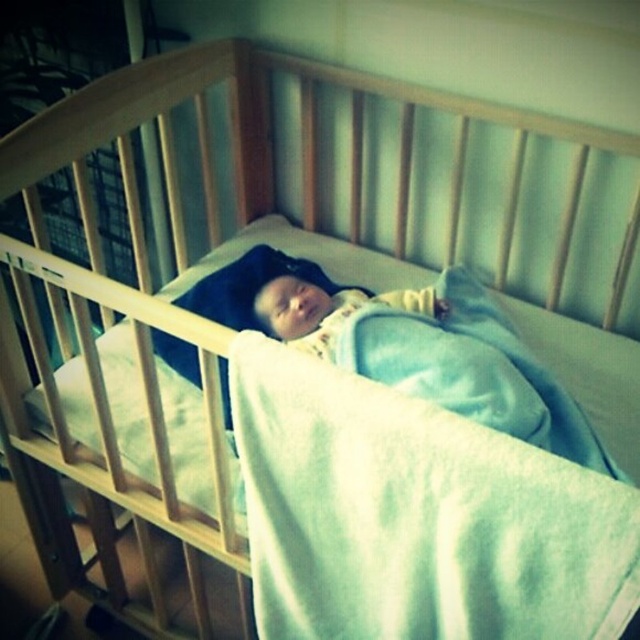
Question: Among these objects, which one is nearest to the camera?

Choices:
 (A) soft yellow fabric at center
 (B) light blue soft blanket at center

Answer: (B)

Question: Considering the relative positions of light blue soft blanket at center and soft yellow fabric at center in the image provided, where is light blue soft blanket at center located with respect to soft yellow fabric at center?

Choices:
 (A) right
 (B) left

Answer: (A)

Question: Which point is farther to the camera?

Choices:
 (A) light blue soft blanket at center
 (B) soft yellow fabric at center

Answer: (B)

Question: Is light blue soft blanket at center bigger than soft yellow fabric at center?

Choices:
 (A) yes
 (B) no

Answer: (A)

Question: Does light blue soft blanket at center appear on the left side of soft yellow fabric at center?

Choices:
 (A) yes
 (B) no

Answer: (B)